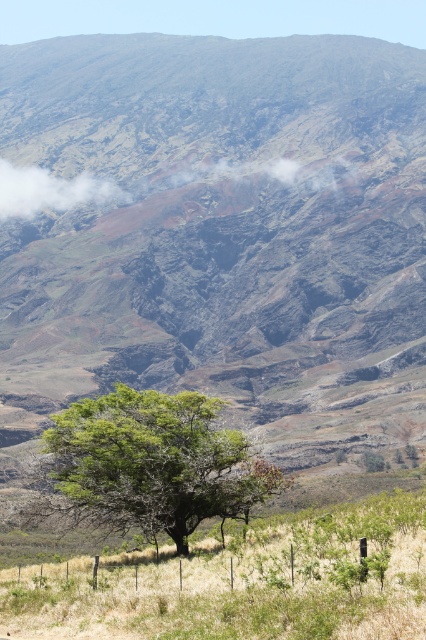
Question: Is dry grass at center to the left of green leafy tree at center from the viewer's perspective?

Choices:
 (A) no
 (B) yes

Answer: (A)

Question: Can you confirm if dry grass at center is smaller than white fluffy cloud at upper center?

Choices:
 (A) yes
 (B) no

Answer: (A)

Question: Considering the real-world distances, which object is farthest from the dry grass at center?

Choices:
 (A) green leafy tree at center
 (B) white fluffy cloud at upper center

Answer: (B)

Question: Which of these objects is positioned farthest from the green leafy tree at center?

Choices:
 (A) dry grass at center
 (B) white fluffy cloud at upper center

Answer: (B)

Question: Which object appears closest to the camera in this image?

Choices:
 (A) green leafy tree at center
 (B) white fluffy cloud at upper center

Answer: (A)

Question: Where is green leafy tree at center located in relation to white fluffy cloud at upper center in the image?

Choices:
 (A) left
 (B) right

Answer: (B)